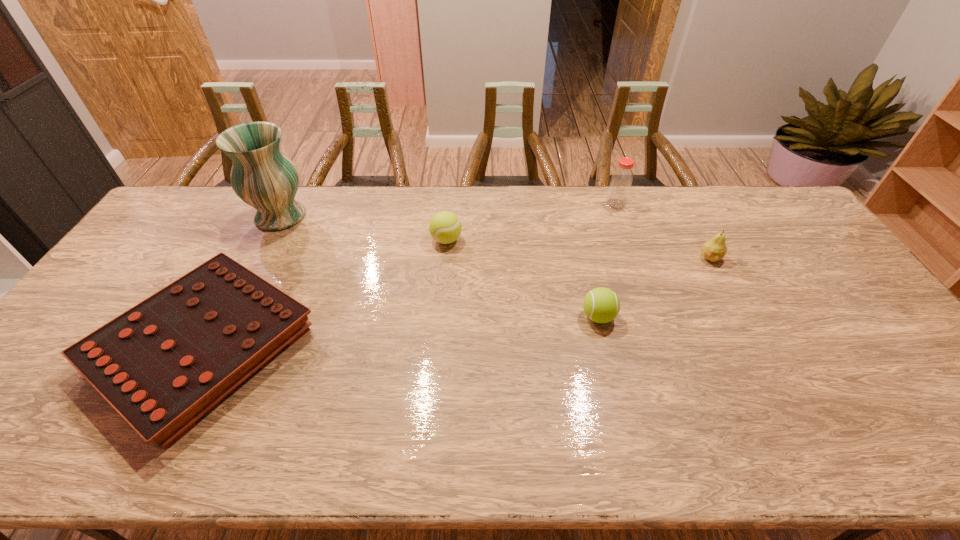
Image resolution: width=960 pixels, height=540 pixels. What are the coordinates of `vacant space located 0.060m on the back of the second tallest object` in the screenshot? It's located at (610, 188).

The height and width of the screenshot is (540, 960). Identify the location of vacant position located on the left of the rightmost object. (612, 258).

Find the location of a particular element. vacant area located on the front of the farther tennis ball is located at coordinates (444, 275).

Locate an element on the screen. The width and height of the screenshot is (960, 540). vacant region located 0.130m on the back of the right tennis ball is located at coordinates (588, 271).

Where is `free space located 0.350m on the back of the gameboard`? free space located 0.350m on the back of the gameboard is located at coordinates (280, 201).

The height and width of the screenshot is (540, 960). Find the location of `vase that is positioned at the far edge`. vase that is positioned at the far edge is located at coordinates (262, 176).

Locate an element on the screen. bottle that is at the far edge is located at coordinates (621, 181).

Locate an element on the screen. This screenshot has height=540, width=960. object located in the near edge section of the desktop is located at coordinates (162, 364).

Identify the location of object located in the left edge section of the desktop. This screenshot has width=960, height=540. (162, 364).

You are a GUI agent. You are given a task and a screenshot of the screen. Output one action in this format:
    pyautogui.click(x=<x>, y=<y>)
    Task: Click on the object present at the near left corner
    The image size is (960, 540).
    Given the screenshot: What is the action you would take?
    pyautogui.click(x=162, y=364)